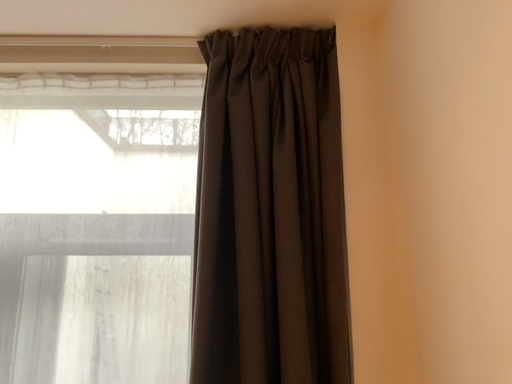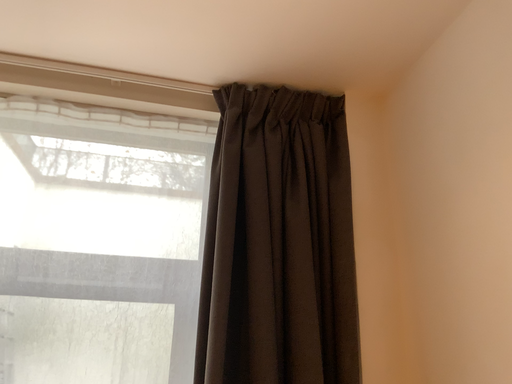
Question: How did the camera likely rotate when shooting the video?

Choices:
 (A) rotated upward
 (B) rotated downward

Answer: (A)